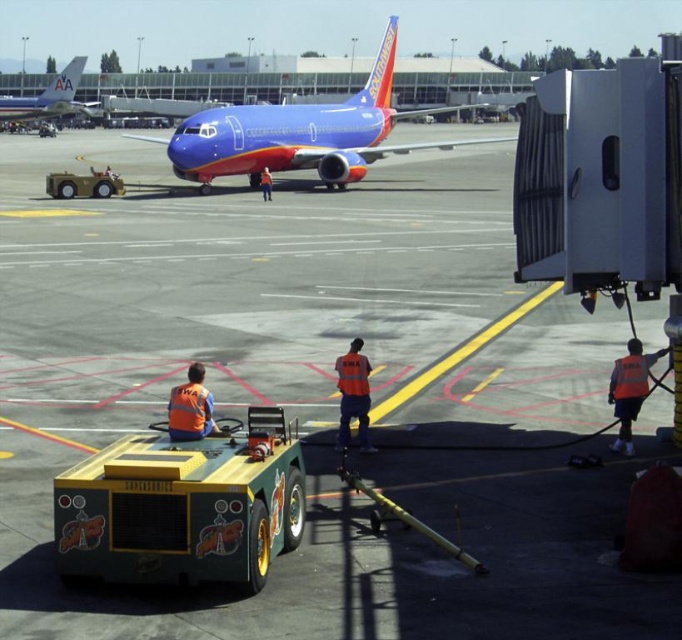
Question: Does blue glossy airplane at center have a lesser width compared to orange reflective vest at lower center?

Choices:
 (A) yes
 (B) no

Answer: (B)

Question: Is blue glossy airplane at center closer to the viewer compared to blue glossy airplane at upper left?

Choices:
 (A) no
 (B) yes

Answer: (B)

Question: Does blue glossy airplane at center have a lesser width compared to blue glossy airplane at upper left?

Choices:
 (A) no
 (B) yes

Answer: (A)

Question: Estimate the real-world distances between objects in this image. Which object is farther from the blue glossy airplane at center?

Choices:
 (A) blue glossy airplane at upper left
 (B) orange reflective safety vest at lower right
 (C) orange reflective vest at lower center

Answer: (C)

Question: Estimate the real-world distances between objects in this image. Which object is closer to the blue glossy airplane at center?

Choices:
 (A) blue glossy airplane at upper left
 (B) orange reflective safety vest at lower right
 (C) orange reflective vest at lower center

Answer: (A)

Question: Among these points, which one is farthest from the camera?

Choices:
 (A) (55, 81)
 (B) (175, 401)
 (C) (647, 355)

Answer: (A)